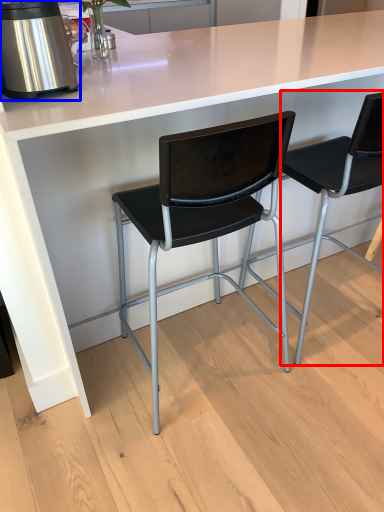
Question: Which object is further to the camera taking this photo, chair (highlighted by a red box) or kitchen appliance (highlighted by a blue box)?

Choices:
 (A) chair
 (B) kitchen appliance

Answer: (A)